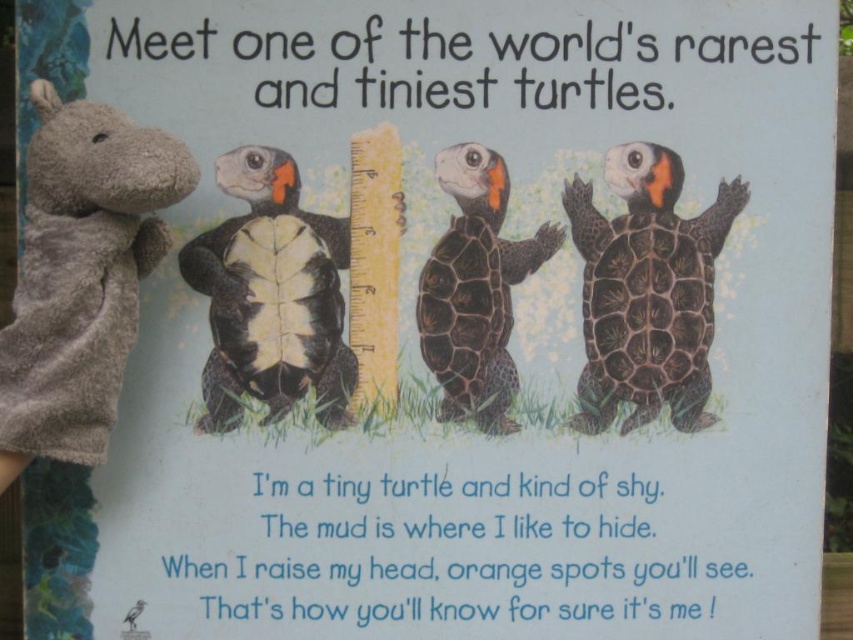
You are a child holding a 6.5 inch ruler. You want to measure the space between the black matte turtle at center and the black textured shell turtle at center on the signboard. Can your ruler reach the entire length of the gap between them?

The distance between the black matte turtle at center and the black textured shell turtle at center is 6.54 inches. Since your ruler is 6.5 inches long, it is slightly shorter than the gap. Therefore, your ruler cannot fully measure the entire length of the space between them.